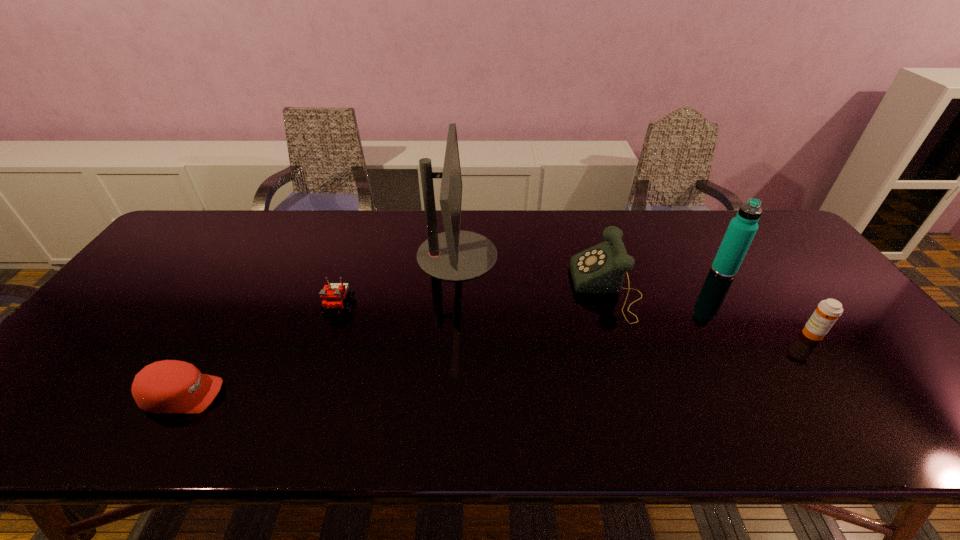
The image size is (960, 540). Find the location of `object that is at the near edge`. object that is at the near edge is located at coordinates (170, 386).

Image resolution: width=960 pixels, height=540 pixels. I want to click on object that is at the right edge, so click(x=827, y=312).

Where is `vacant space at the far edge of the desktop`? This screenshot has height=540, width=960. vacant space at the far edge of the desktop is located at coordinates (588, 214).

The width and height of the screenshot is (960, 540). I want to click on vacant area at the near edge, so click(x=159, y=428).

Where is `vacant position at the left edge of the desktop`? vacant position at the left edge of the desktop is located at coordinates (176, 265).

You are a GUI agent. You are given a task and a screenshot of the screen. Output one action in this format:
    pyautogui.click(x=<x>, y=<y>)
    Task: Click on the free spot at the right edge of the desktop
    
    Given the screenshot: What is the action you would take?
    pyautogui.click(x=899, y=404)

In the image, there is a desktop. At what (x,y) coordinates should I click in order to perform the action: click on vacant space at the far left corner. Please return your answer as a coordinate pair (x, y). The image size is (960, 540). Looking at the image, I should click on (187, 221).

Find the location of a particular element. The height and width of the screenshot is (540, 960). blank region between the computer monitor and the telephone is located at coordinates (532, 272).

Image resolution: width=960 pixels, height=540 pixels. I want to click on empty space that is in between the Lego and the rightmost object, so click(575, 321).

Locate an element on the screen. The image size is (960, 540). unoccupied position between the Lego and the third object from left to right is located at coordinates (398, 281).